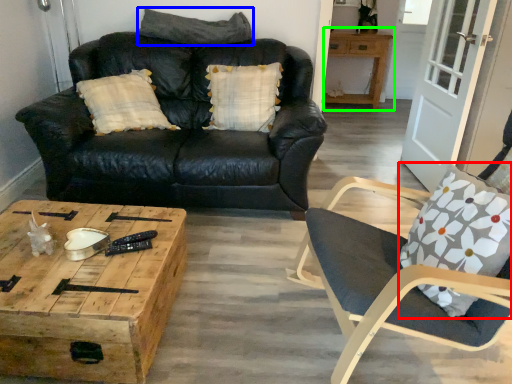
Question: Which is farther away from throw pillow (highlighted by a red box)? pillow (highlighted by a blue box) or table (highlighted by a green box)?

Choices:
 (A) pillow
 (B) table

Answer: (B)